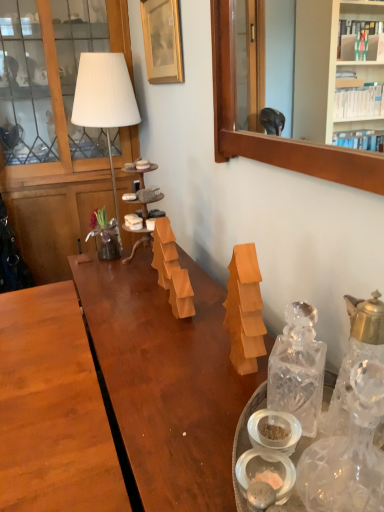
Locate an element on the screen. free location to the left of transparent glass bottle at right, which is counted as the 2th bottle, starting from the right is located at coordinates (243, 408).